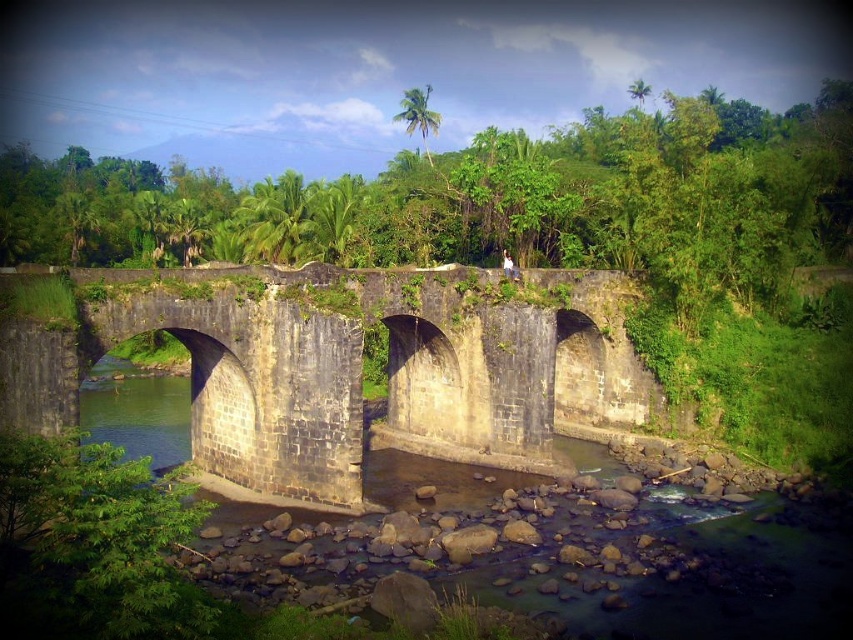
Question: Which object appears closest to the camera in this image?

Choices:
 (A) stone bridge at center
 (B) green leafy vegetation at center

Answer: (A)

Question: Is green leafy vegetation at center to the right of stone bridge at center from the viewer's perspective?

Choices:
 (A) yes
 (B) no

Answer: (B)

Question: Considering the relative positions of green leafy vegetation at center and stone bridge at center in the image provided, where is green leafy vegetation at center located with respect to stone bridge at center?

Choices:
 (A) above
 (B) below

Answer: (A)

Question: Can you confirm if green leafy vegetation at center is smaller than stone bridge at center?

Choices:
 (A) yes
 (B) no

Answer: (B)